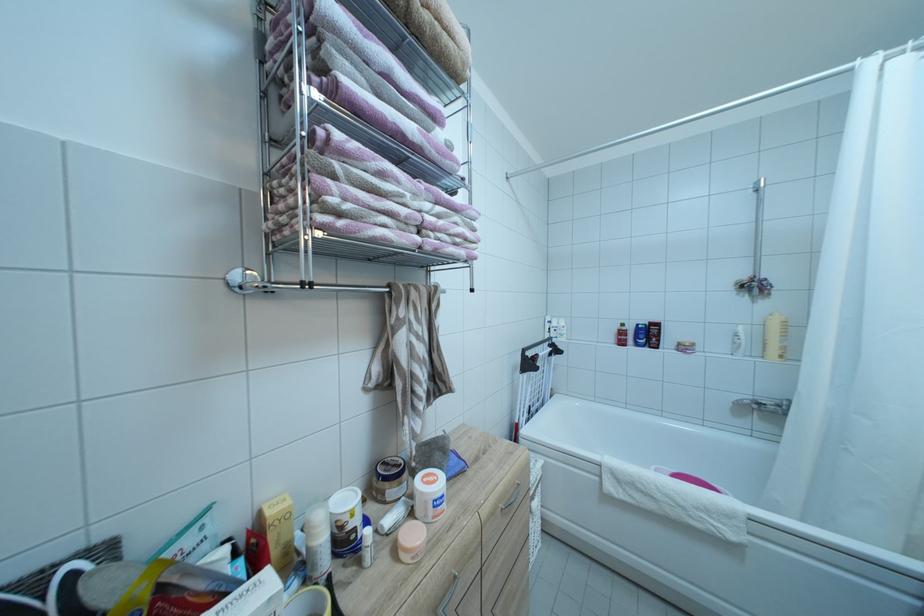
This screenshot has height=616, width=924. What do you see at coordinates (344, 499) in the screenshot? I see `a white container lid` at bounding box center [344, 499].